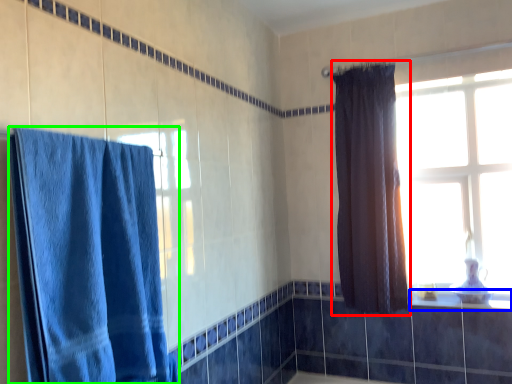
Question: Considering the real-world distances, which object is closest to curtain (highlighted by a red box)? window sill (highlighted by a blue box) or curtain (highlighted by a green box).

Choices:
 (A) window sill
 (B) curtain

Answer: (A)